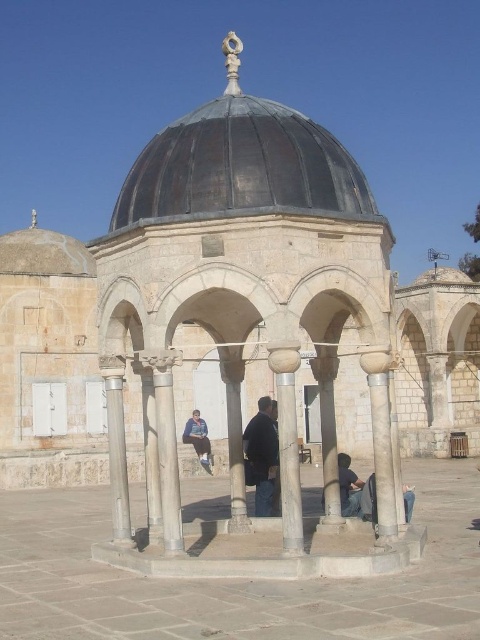
You are an architect assessing the structural integrity of the rusty metal dome at center and the black matte jacket at center. Which object has a larger diameter or width?

The rusty metal dome at center might be wider than black matte jacket at center according to the description.

You are an architect visiting the Dome of the Rock and notice the rusty metal dome at center and the black matte jacket at center. Which object is taller when viewed from the ground level?

The rusty metal dome at center is taller than the black matte jacket at center.

You are an architect designing a new Islamic shrine inspired by the Dome of the Rock. You want to place a small garden between the rusty metal dome at center and the nearest arch. How far apart are these two structures to ensure proper spacing?

The rusty metal dome at center and the nearest arch are 89.45 feet apart, so you should maintain that distance for proper spacing.